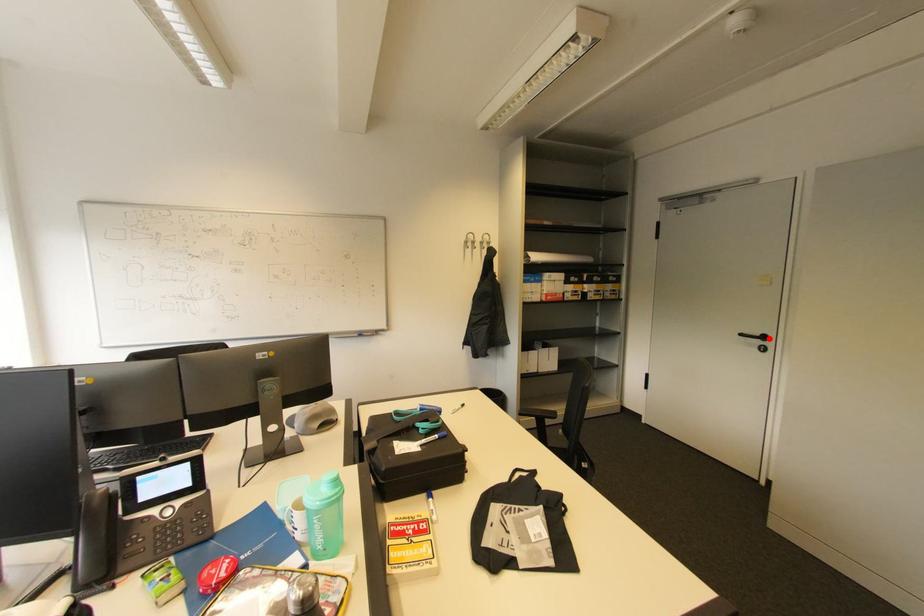
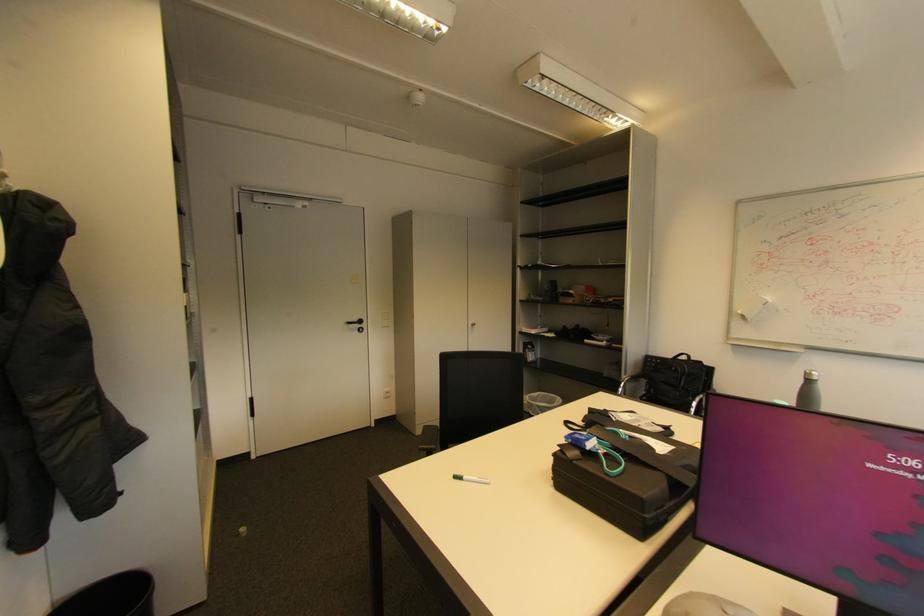
Locate, in the second image, the point that corresponds to the highlighted location in the first image.

(366, 322)